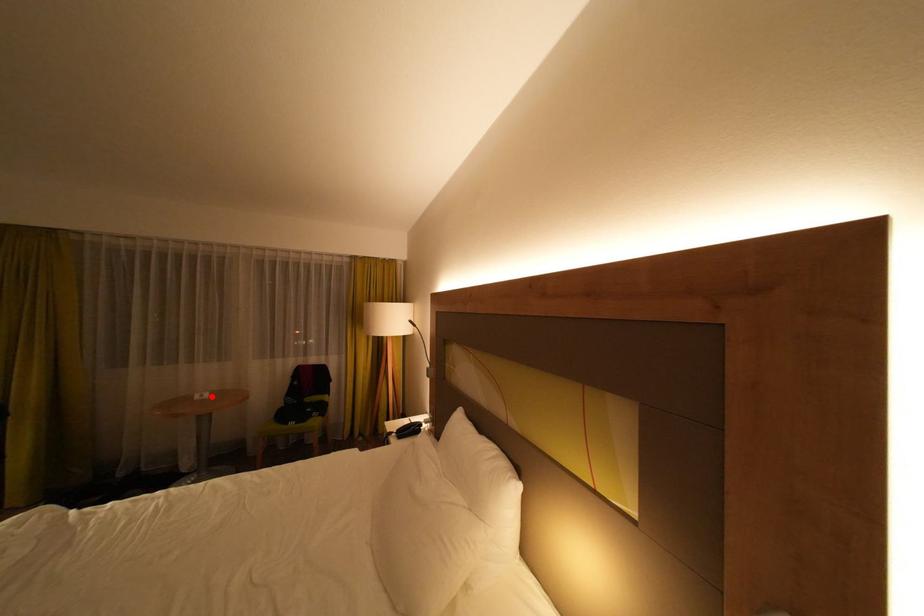
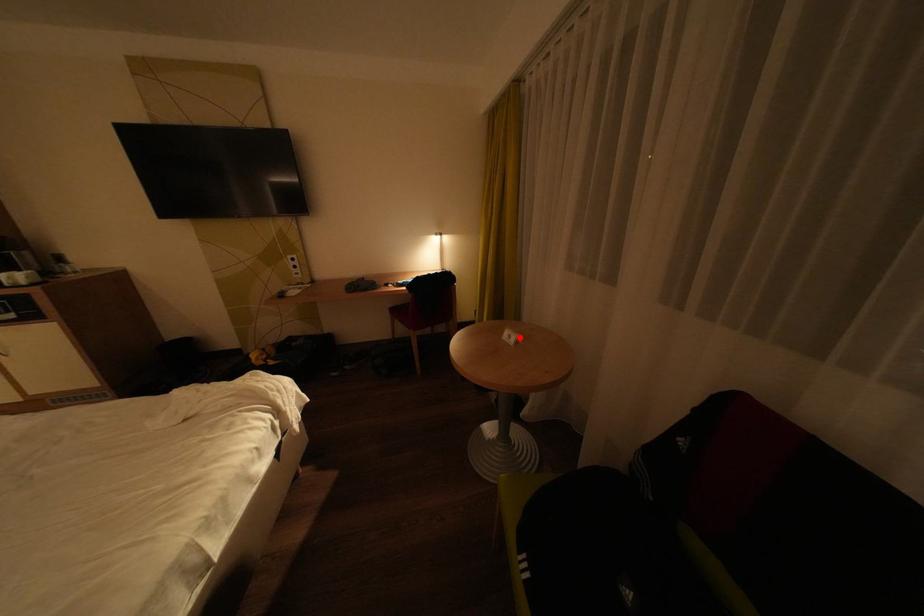
I am providing you with two images of the same scene from different viewpoints. A red point is marked on the first image and another point is marked on the second image. Are the points marked in image1 and image2 representing the same 3D position?

Yes